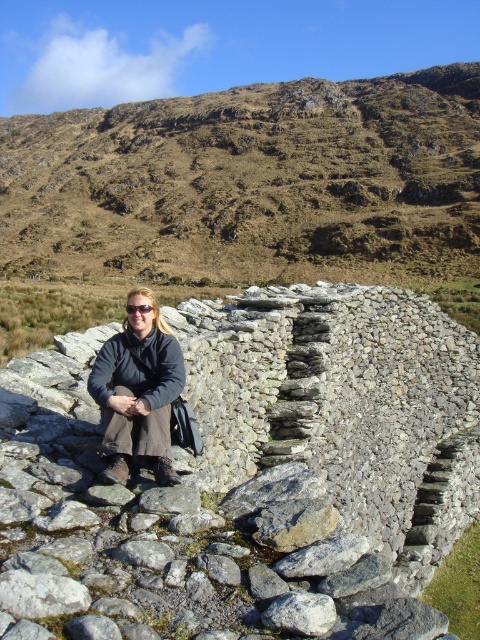
Which is behind, point (313, 529) or point (105, 420)?

Point (105, 420)

Is gray rough stone wall at center to the left of matte black coat at center from the viewer's perspective?

Indeed, gray rough stone wall at center is positioned on the left side of matte black coat at center.

Does point (39, 392) lie in front of point (176, 339)?

No.

Identify the location of gray rough stone wall at center. Image resolution: width=480 pixels, height=640 pixels. (240, 468).

Can you confirm if brown grassy hillside at upper center is positioned to the left of matte black coat at center?

Correct, you'll find brown grassy hillside at upper center to the left of matte black coat at center.

The height and width of the screenshot is (640, 480). Identify the location of brown grassy hillside at upper center. (251, 182).

Who is more distant from viewer, (x=213, y=612) or (x=381, y=189)?

The point (x=381, y=189) is more distant.

Looking at this image, can you confirm if gray rough stone wall at center is smaller than brown grassy hillside at upper center?

Indeed, gray rough stone wall at center has a smaller size compared to brown grassy hillside at upper center.

I want to click on gray rough stone wall at center, so click(240, 468).